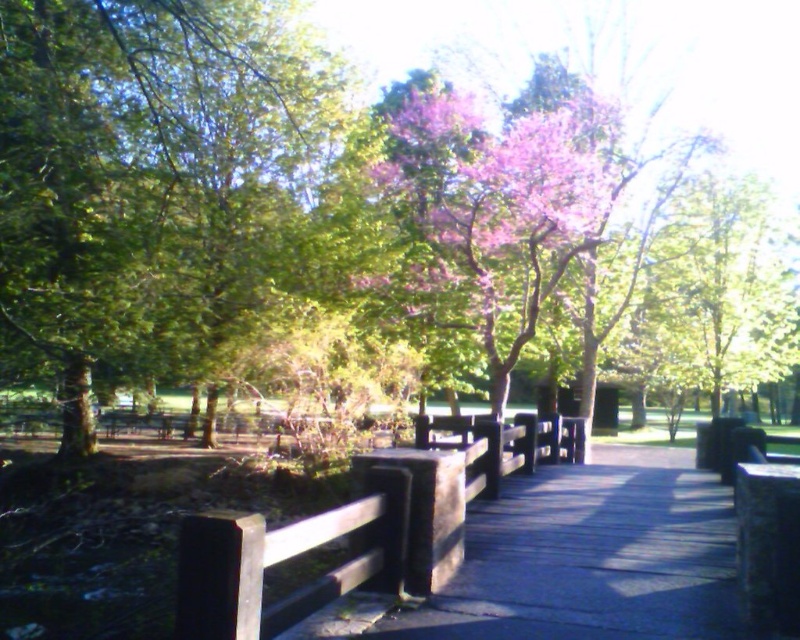
You are a painter standing on the wooden bridge and want to capture the pink silky flowers at center and the brown wood rail at center in your painting. Which object should you focus on more because it is larger?

A: The pink silky flowers at center is bigger than the brown wood rail at center, so you should focus more on the pink silky flowers at center in your painting.

You are a painter setting up an easel to capture the scene of the pink silky flowers at center and the brown wood rail at center. You want to ensure your canvas can fit both subjects. Based on their widths, which one requires more horizontal space on the canvas?

The pink silky flowers at center might be wider than brown wood rail at center, so it requires more horizontal space on the canvas.

You are a hiker carrying a 2.5 meter wide tent. You need to cross the wooden bridge at center and pass by the pink silky flowers at center. Can your tent fit through the bridge and around the flowers without getting stuck?

The wooden bridge at center has a lesser width compared to pink silky flowers at center. Since the bridge is narrower than the flowers, the tent which is 2.5 meters wide may not fit through the bridge. However, the flowers are wider, so you need to ensure there is enough space around them as well. It is uncertain if the tent will fit without getting stuck.